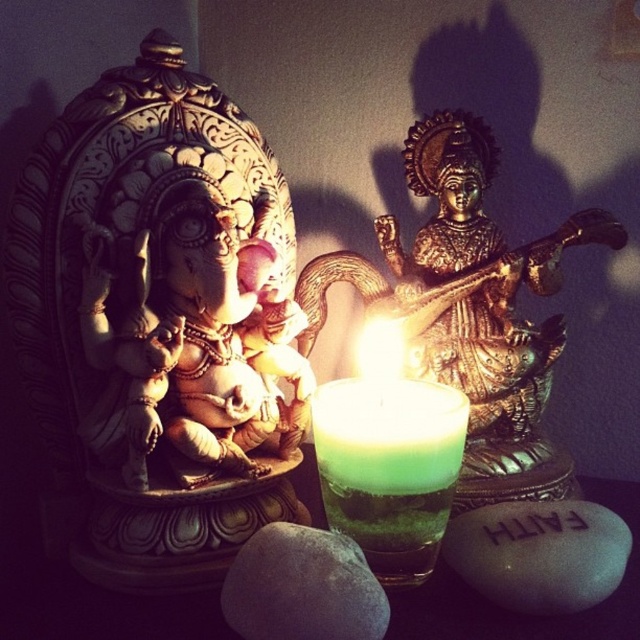
You are a visitor at a temple and see the white smooth stone at center and the gray matte rock at center. Which object is taller?

The white smooth stone at center is much taller than the gray matte rock at center.

You are a temple caretaker who needs to place a new offering on the altar. The altar has limited space, and you have to choose between placing the green wax candle at center or the white smooth stone at center. Based on their sizes, which object can fit better in a narrow space?

The green wax candle at center has a smaller width compared to the white smooth stone at center, so it can fit better in a narrow space.

You are a sculptor who wants to place a small decorative item between the white smooth stone at center and the gray matte rock at center. Given that the item is 10 cm wide, will it fit in the space between them?

The white smooth stone at center is wider than the gray matte rock at center, but the description does not provide the exact distance between them. Therefore, it is uncertain if the 10 cm wide item will fit.